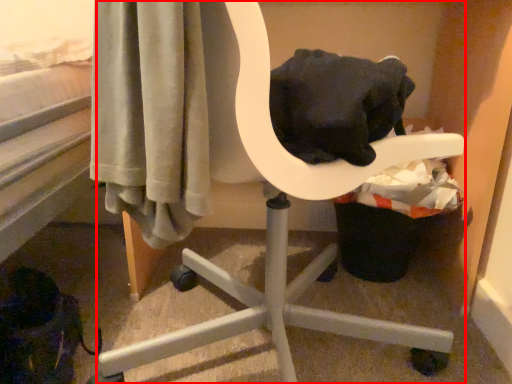
Question: In this image, where is chair (annotated by the red box) located relative to laundry basket?

Choices:
 (A) right
 (B) left

Answer: (B)